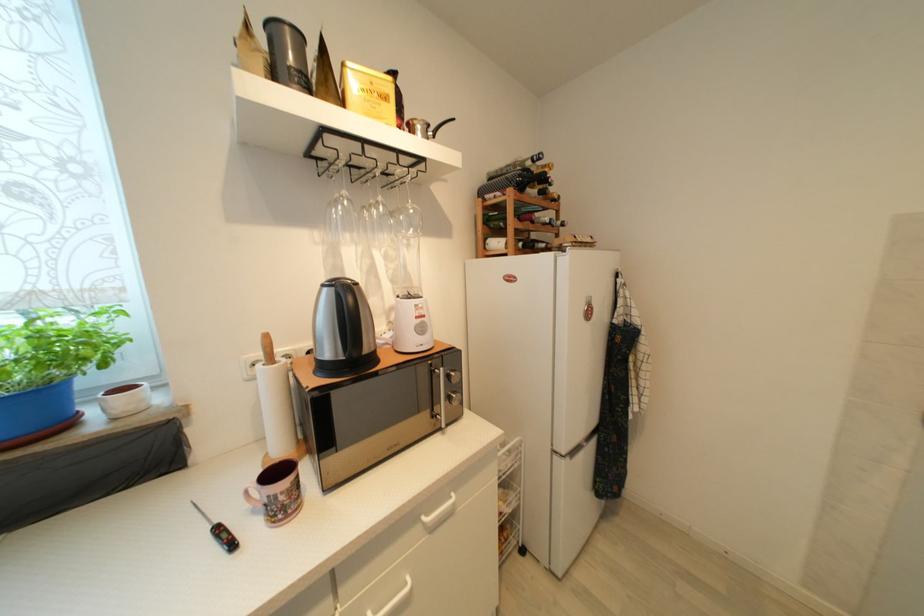
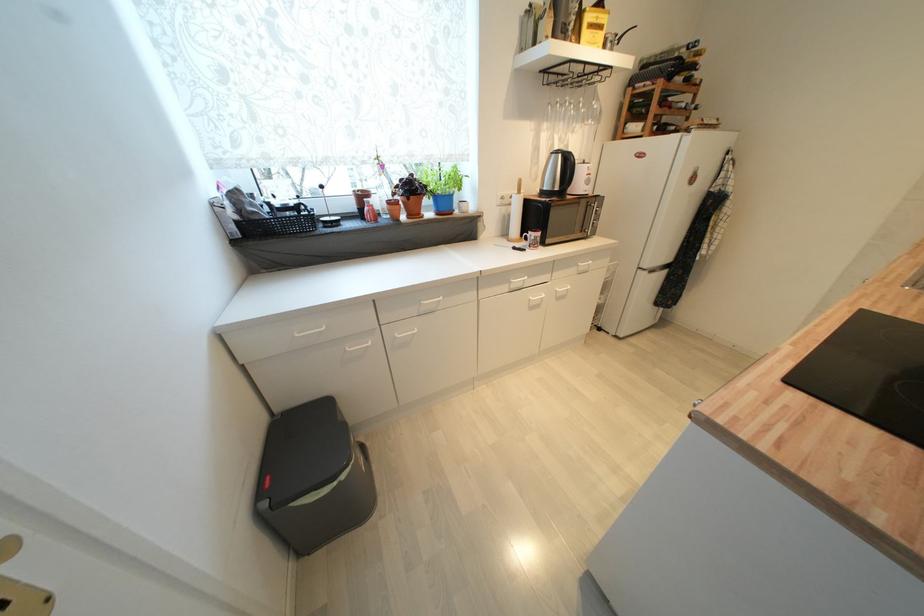
Find the pixel in the second image that matches the point at 525,228 in the first image.

(664, 114)